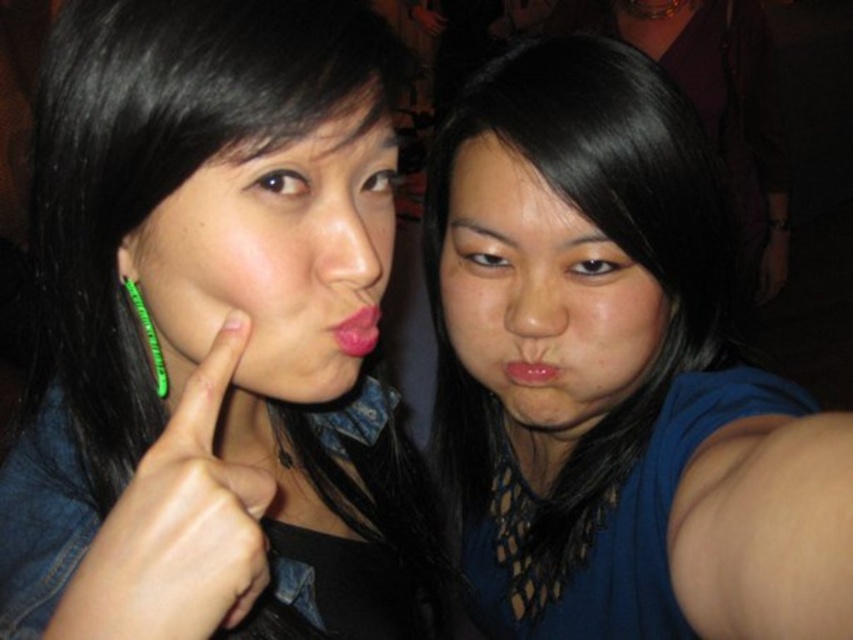
Question: Is blue fabric shirt at center further to the viewer compared to matte pink lips at center?

Choices:
 (A) yes
 (B) no

Answer: (B)

Question: Which point is farther from the camera taking this photo?

Choices:
 (A) (190, 620)
 (B) (746, 541)

Answer: (A)

Question: Which point is farther from the camera taking this photo?

Choices:
 (A) (683, 163)
 (B) (543, 372)
 (C) (85, 77)
 (D) (163, 584)

Answer: (B)

Question: Does matte pink lips at center appear on the right side of pink matte lips at center?

Choices:
 (A) yes
 (B) no

Answer: (B)

Question: Among these points, which one is farthest from the camera?

Choices:
 (A) (140, 477)
 (B) (573, 592)
 (C) (550, 365)

Answer: (B)

Question: Is green plastic ring at upper left closer to camera compared to pink matte lips at center?

Choices:
 (A) yes
 (B) no

Answer: (A)